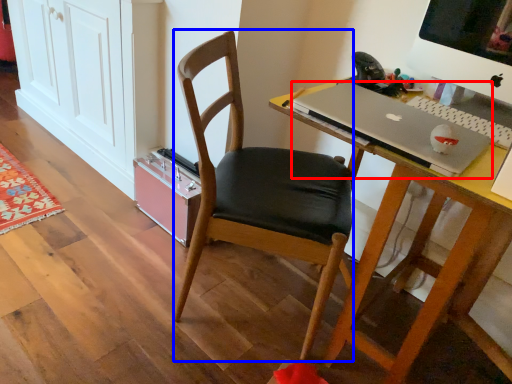
Question: Which point is closer to the camera, laptop (highlighted by a red box) or chair (highlighted by a blue box)?

Choices:
 (A) laptop
 (B) chair

Answer: (A)